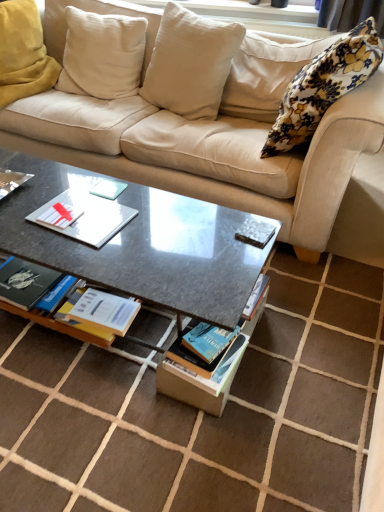
The height and width of the screenshot is (512, 384). I want to click on free space on the front side of white matte paper at center, so click(x=77, y=257).